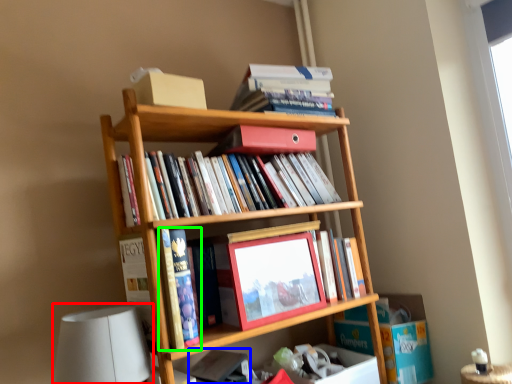
Question: Which object is positioned farthest from table lamp (highlighted by a red box)? Select from book (highlighted by a blue box) and book (highlighted by a green box).

Choices:
 (A) book
 (B) book

Answer: (A)